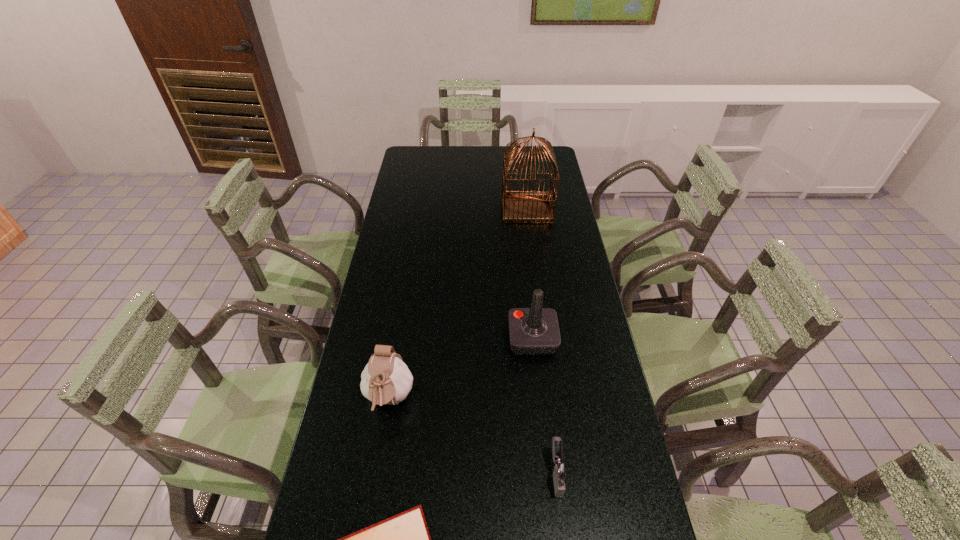
Image resolution: width=960 pixels, height=540 pixels. I want to click on object located at the left edge, so click(386, 379).

The width and height of the screenshot is (960, 540). In order to click on birdcage that is at the right edge in this screenshot , I will do `click(519, 206)`.

Find the location of a particular element. joystick that is positioned at the right edge is located at coordinates (532, 331).

Locate an element on the screen. This screenshot has height=540, width=960. igniter located at the right edge is located at coordinates (559, 469).

Locate an element on the screen. vacant space at the far edge is located at coordinates (481, 165).

The image size is (960, 540). I want to click on vacant space at the left edge of the desktop, so click(x=387, y=248).

This screenshot has width=960, height=540. I want to click on blank space at the right edge of the desktop, so click(568, 264).

In the image, there is a desktop. At what (x,y) coordinates should I click in order to perform the action: click on vacant space at the far left corner. Please return your answer as a coordinate pair (x, y). Looking at the image, I should click on (431, 168).

In the image, there is a desktop. Identify the location of vacant space at the far right corner. This screenshot has width=960, height=540. (557, 170).

In order to click on vacant area between the farthest object and the joystick in this screenshot , I will do `click(530, 274)`.